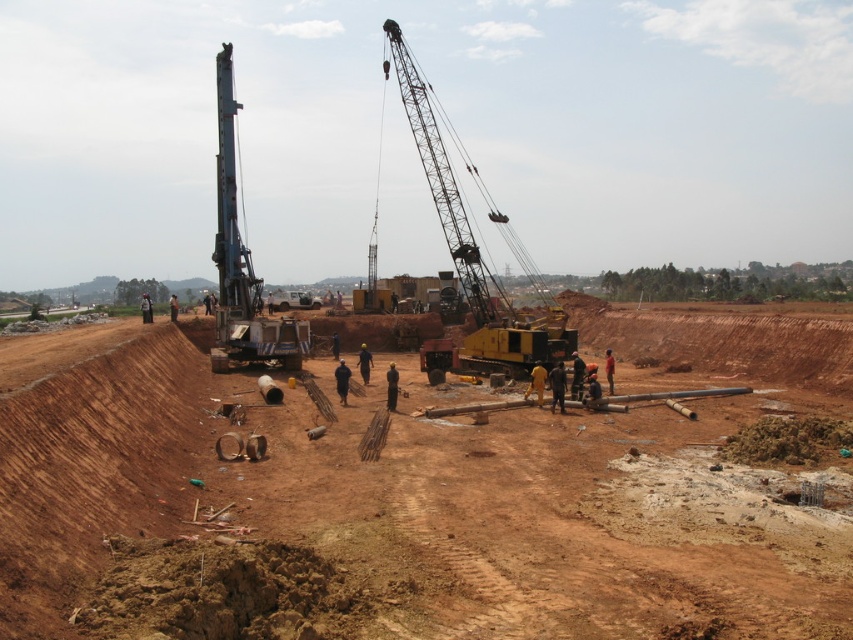
Question: Which point is farther from the camera taking this photo?

Choices:
 (A) (514, 316)
 (B) (219, 134)

Answer: (B)

Question: Which object appears farthest from the camera in this image?

Choices:
 (A) metallic yellow crane at center
 (B) metallic gray drilling rig at left
 (C) brown dirt at lower left

Answer: (B)

Question: Can you confirm if brown dirt at lower left is positioned below metallic yellow crane at center?

Choices:
 (A) yes
 (B) no

Answer: (A)

Question: Can you confirm if brown dirt at lower left is positioned to the left of metallic yellow crane at center?

Choices:
 (A) yes
 (B) no

Answer: (A)

Question: Is brown dirt at lower left bigger than metallic gray drilling rig at left?

Choices:
 (A) no
 (B) yes

Answer: (A)

Question: Based on their relative distances, which object is nearer to the brown dirt at lower left?

Choices:
 (A) metallic yellow crane at center
 (B) metallic gray drilling rig at left

Answer: (B)